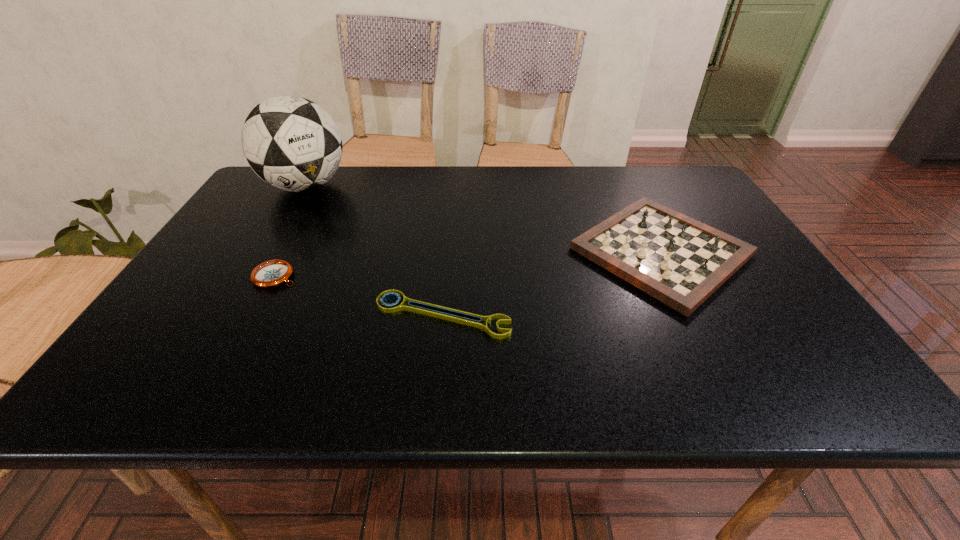
This screenshot has height=540, width=960. Find the location of `soccer ball at the far edge`. soccer ball at the far edge is located at coordinates click(291, 143).

The height and width of the screenshot is (540, 960). What are the coordinates of `chessboard at the far edge` in the screenshot? It's located at (680, 261).

You are a GUI agent. You are given a task and a screenshot of the screen. Output one action in this format:
    pyautogui.click(x=<x>, y=<y>)
    Task: Click on the soccer ball located in the left edge section of the desktop
    The height and width of the screenshot is (540, 960).
    Given the screenshot: What is the action you would take?
    pyautogui.click(x=291, y=143)

I want to click on compass present at the left edge, so click(272, 273).

What are the coordinates of `object that is at the right edge` in the screenshot? It's located at click(x=680, y=261).

Where is `object present at the far left corner`? object present at the far left corner is located at coordinates (291, 143).

Find the location of `object that is positioned at the far right corner`. object that is positioned at the far right corner is located at coordinates (680, 261).

In the image, there is a desktop. At what (x,y) coordinates should I click in order to perform the action: click on vacant space at the far edge. Please return your answer as a coordinate pair (x, y). Looking at the image, I should click on (547, 190).

This screenshot has height=540, width=960. I want to click on free spot at the left edge of the desktop, so (164, 340).

This screenshot has height=540, width=960. In the image, there is a desktop. In order to click on vacant space at the right edge in this screenshot , I will do `click(797, 307)`.